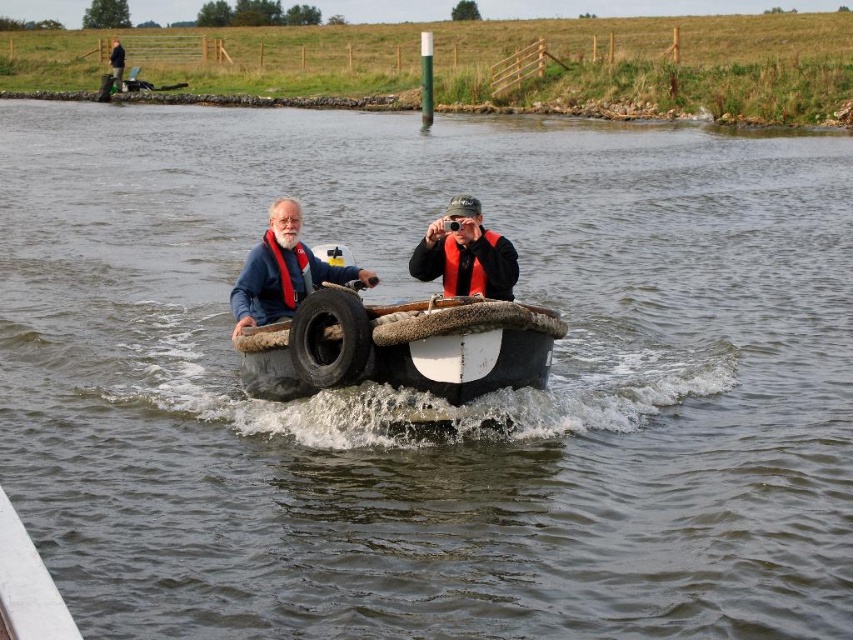
Question: Is white rubber boat at center smaller than orange life vest at center?

Choices:
 (A) no
 (B) yes

Answer: (B)

Question: Which object is farther from the camera taking this photo?

Choices:
 (A) dark green jacket at upper left
 (B) blue denim jacket at center
 (C) orange life vest at center
 (D) red life jacket at center

Answer: (A)

Question: Can you confirm if white rubber boat at center is thinner than dark green jacket at upper left?

Choices:
 (A) no
 (B) yes

Answer: (B)

Question: Can you confirm if white rubber boat at center is wider than orange life vest at center?

Choices:
 (A) no
 (B) yes

Answer: (A)

Question: Which object appears closest to the camera in this image?

Choices:
 (A) dark green jacket at upper left
 (B) blue denim jacket at center
 (C) white rubber boat at center

Answer: (C)

Question: Which of these objects is positioned closest to the orange life vest at center?

Choices:
 (A) black rubber tire at center
 (B) white rubber boat at center

Answer: (A)